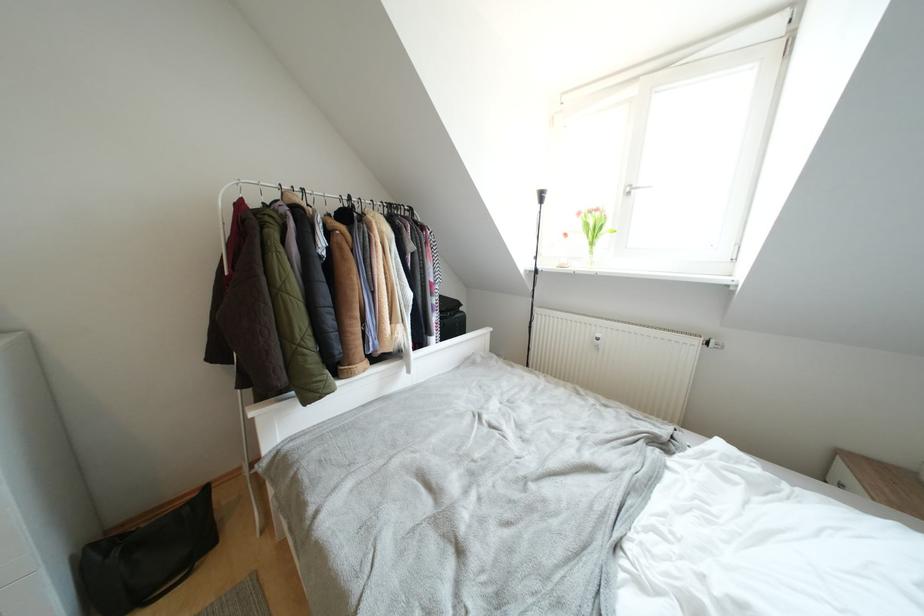
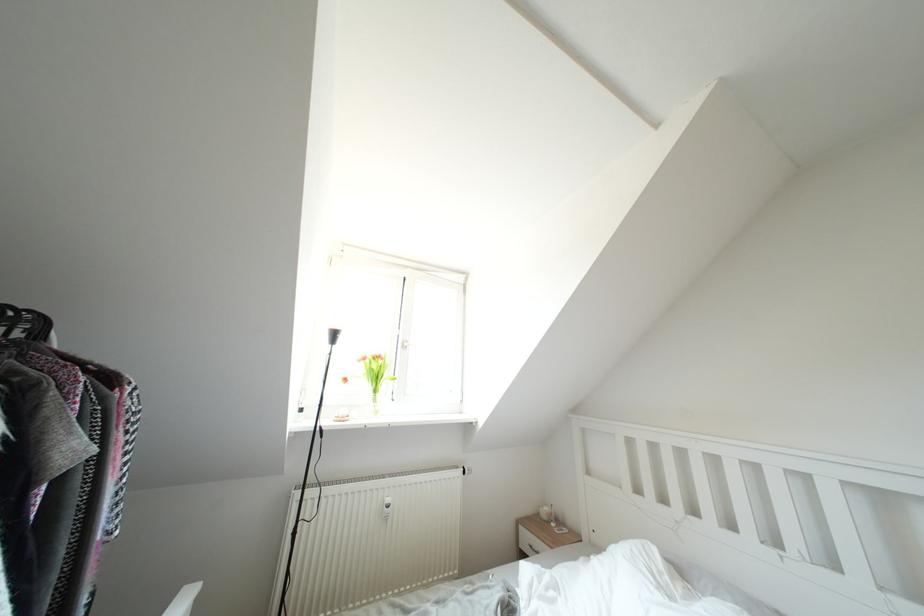
Locate, in the second image, the point that corresponds to (584,217) in the first image.

(370, 363)